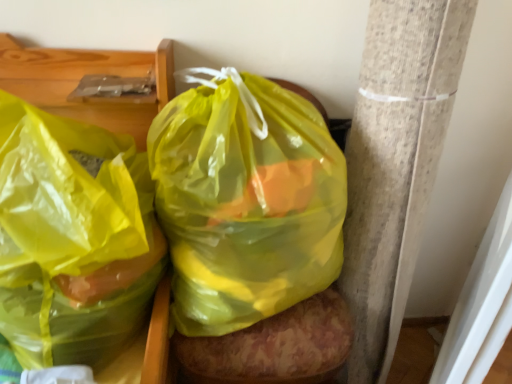
Question: Is translucent yellow plastic bag at center, the first plastic bag in the right-to-left sequence, spatially inside translucent yellow plastic bag at left, which is the second plastic bag from right to left, or outside of it?

Choices:
 (A) inside
 (B) outside

Answer: (B)

Question: Is point (183, 241) positioned closer to the camera than point (11, 326)?

Choices:
 (A) farther
 (B) closer

Answer: (A)

Question: Is translucent yellow plastic bag at center, arranged as the 2th plastic bag when viewed from the left, wider or thinner than translucent yellow plastic bag at left, which is the 1th plastic bag in left-to-right order?

Choices:
 (A) wide
 (B) thin

Answer: (B)

Question: From the image's perspective, is translucent yellow plastic bag at left, which is the second plastic bag from right to left, positioned above or below translucent yellow plastic bag at center, the first plastic bag in the right-to-left sequence?

Choices:
 (A) above
 (B) below

Answer: (B)

Question: Considering the relative positions of translucent yellow plastic bag at left, which is the second plastic bag from right to left, and translucent yellow plastic bag at center, arranged as the 2th plastic bag when viewed from the left, in the image provided, is translucent yellow plastic bag at left, which is the second plastic bag from right to left, to the left or to the right of translucent yellow plastic bag at center, arranged as the 2th plastic bag when viewed from the left,?

Choices:
 (A) left
 (B) right

Answer: (A)

Question: Considering their positions, is translucent yellow plastic bag at left, which is the 1th plastic bag in left-to-right order, located in front of or behind translucent yellow plastic bag at center, the first plastic bag in the right-to-left sequence?

Choices:
 (A) behind
 (B) front

Answer: (B)

Question: In terms of height, does translucent yellow plastic bag at left, which is the 1th plastic bag in left-to-right order, look taller or shorter compared to translucent yellow plastic bag at center, arranged as the 2th plastic bag when viewed from the left?

Choices:
 (A) tall
 (B) short

Answer: (B)